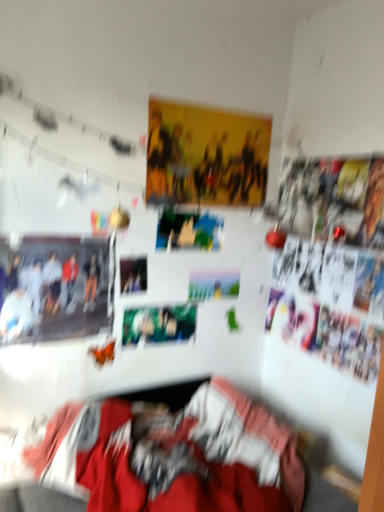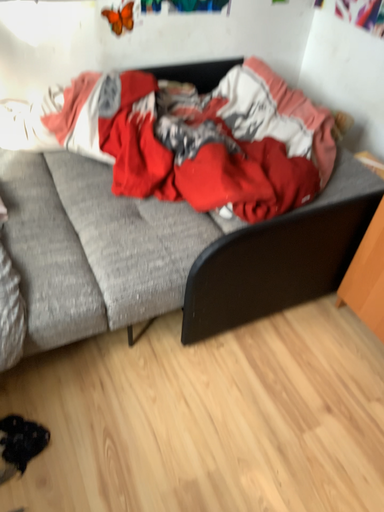
Question: Which way did the camera rotate in the video?

Choices:
 (A) rotated upward
 (B) rotated downward

Answer: (B)